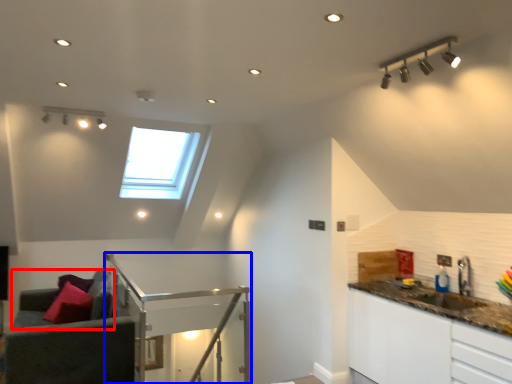
Question: Which object is closer to the camera taking this photo, couch (highlighted by a red box) or balustrade (highlighted by a blue box)?

Choices:
 (A) couch
 (B) balustrade

Answer: (B)